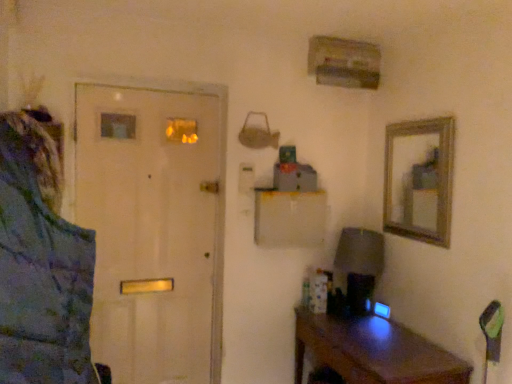
Question: From the image's perspective, is brown wooden desk at lower right on matte gray lampshade at right?

Choices:
 (A) no
 (B) yes

Answer: (A)

Question: Is brown wooden desk at lower right at the left side of matte gray lampshade at right?

Choices:
 (A) no
 (B) yes

Answer: (A)

Question: Is the surface of brown wooden desk at lower right in direct contact with matte gray lampshade at right?

Choices:
 (A) no
 (B) yes

Answer: (A)

Question: Is brown wooden desk at lower right oriented towards matte gray lampshade at right?

Choices:
 (A) yes
 (B) no

Answer: (B)

Question: Considering the relative sizes of brown wooden desk at lower right and matte gray lampshade at right in the image provided, is brown wooden desk at lower right wider than matte gray lampshade at right?

Choices:
 (A) yes
 (B) no

Answer: (A)

Question: Is brown wooden desk at lower right positioned far away from matte gray lampshade at right?

Choices:
 (A) yes
 (B) no

Answer: (B)

Question: Considering the relative sizes of blue textured jacket at left and brown wooden desk at lower right in the image provided, is blue textured jacket at left thinner than brown wooden desk at lower right?

Choices:
 (A) no
 (B) yes

Answer: (B)

Question: Is blue textured jacket at left facing towards brown wooden desk at lower right?

Choices:
 (A) yes
 (B) no

Answer: (B)

Question: Considering the relative sizes of blue textured jacket at left and brown wooden desk at lower right in the image provided, is blue textured jacket at left shorter than brown wooden desk at lower right?

Choices:
 (A) yes
 (B) no

Answer: (B)

Question: From the image's perspective, is blue textured jacket at left located beneath brown wooden desk at lower right?

Choices:
 (A) no
 (B) yes

Answer: (A)

Question: Is blue textured jacket at left taller than brown wooden desk at lower right?

Choices:
 (A) yes
 (B) no

Answer: (A)

Question: Is blue textured jacket at left positioned far away from brown wooden desk at lower right?

Choices:
 (A) no
 (B) yes

Answer: (B)

Question: Is white matte door at left to the right of brown wooden desk at lower right from the viewer's perspective?

Choices:
 (A) no
 (B) yes

Answer: (A)